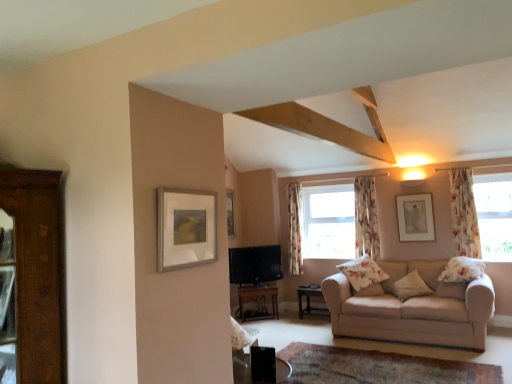
Question: Can you confirm if floral fabric curtain at center, which is counted as the third curtain, starting from the front, is smaller than transparent floral curtains at upper right, the 1th window when ordered from front to back?

Choices:
 (A) no
 (B) yes

Answer: (A)

Question: Is floral fabric curtain at center, which ranks as the 1th curtain in back-to-front order, to the right of transparent floral curtains at upper right, placed as the second window when sorted from back to front, from the viewer's perspective?

Choices:
 (A) yes
 (B) no

Answer: (B)

Question: Considering the relative sizes of floral fabric curtain at center, which is counted as the third curtain, starting from the front, and transparent floral curtains at upper right, acting as the second window starting from the left, in the image provided, is floral fabric curtain at center, which is counted as the third curtain, starting from the front, taller than transparent floral curtains at upper right, acting as the second window starting from the left,?

Choices:
 (A) no
 (B) yes

Answer: (B)

Question: Is floral fabric curtain at center, the third curtain positioned from the right, positioned behind transparent floral curtains at upper right, placed as the second window when sorted from back to front?

Choices:
 (A) yes
 (B) no

Answer: (A)

Question: Is floral fabric curtain at center, which ranks as the 1th curtain in back-to-front order, facing towards transparent floral curtains at upper right, placed as the second window when sorted from back to front?

Choices:
 (A) yes
 (B) no

Answer: (B)

Question: From a real-world perspective, relative to beige fabric couch at lower right, is matte silver picture frame at upper left, the second picture frame from the right, vertically above or below?

Choices:
 (A) below
 (B) above

Answer: (B)

Question: In terms of width, does matte silver picture frame at upper left, which is counted as the first picture frame, starting from the left, look wider or thinner when compared to beige fabric couch at lower right?

Choices:
 (A) wide
 (B) thin

Answer: (B)

Question: From the image's perspective, is matte silver picture frame at upper left, which is counted as the first picture frame, starting from the left, above or below beige fabric couch at lower right?

Choices:
 (A) below
 (B) above

Answer: (B)

Question: From their relative heights in the image, would you say matte silver picture frame at upper left, which is counted as the first picture frame, starting from the left, is taller or shorter than beige fabric couch at lower right?

Choices:
 (A) tall
 (B) short

Answer: (B)

Question: From the image's perspective, relative to matte black tv at center, is floral fabric curtain at center, the third curtain positioned from the right, above or below?

Choices:
 (A) above
 (B) below

Answer: (A)

Question: Is floral fabric curtain at center, the third curtain positioned from the right, taller or shorter than matte black tv at center?

Choices:
 (A) short
 (B) tall

Answer: (B)

Question: Is floral fabric curtain at center, which is counted as the third curtain, starting from the front, situated inside matte black tv at center or outside?

Choices:
 (A) outside
 (B) inside

Answer: (A)

Question: Is floral fabric curtain at center, the third curtain positioned from the right, in front of or behind matte black tv at center in the image?

Choices:
 (A) front
 (B) behind

Answer: (B)

Question: Is beige fabric couch at lower right in front of or behind floral fabric curtain at right, the 3th curtain positioned from the back, in the image?

Choices:
 (A) front
 (B) behind

Answer: (A)

Question: In terms of size, does beige fabric couch at lower right appear bigger or smaller than floral fabric curtain at right, the 1th curtain when ordered from right to left?

Choices:
 (A) big
 (B) small

Answer: (A)